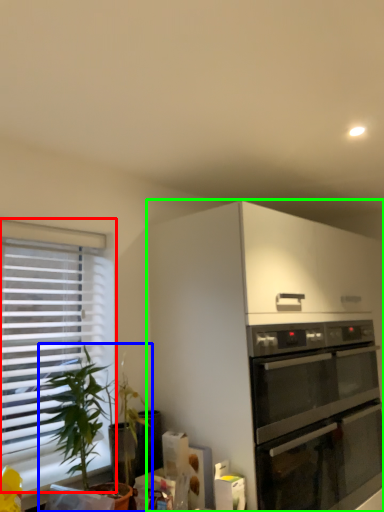
Question: Which object is the closest to the window (highlighted by a red box)? Choose among these: houseplant (highlighted by a blue box) or cabinetry (highlighted by a green box).

Choices:
 (A) houseplant
 (B) cabinetry

Answer: (A)